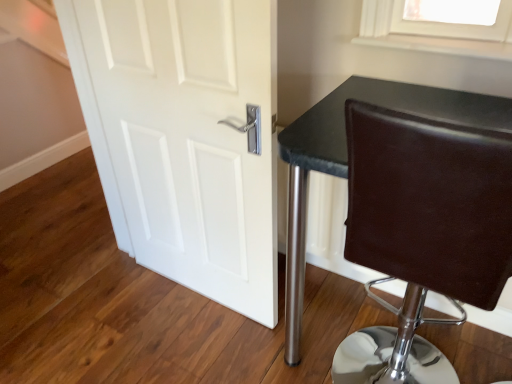
Where is `brown leather chair at right`? brown leather chair at right is located at coordinates (422, 232).

What do you see at coordinates (422, 232) in the screenshot?
I see `brown leather chair at right` at bounding box center [422, 232].

Identify the location of white matte door at center. The height and width of the screenshot is (384, 512). (187, 138).

The width and height of the screenshot is (512, 384). What do you see at coordinates (187, 138) in the screenshot? I see `white matte door at center` at bounding box center [187, 138].

In order to click on brown leather chair at right in this screenshot , I will do `click(422, 232)`.

Between brown leather chair at right and white matte door at center, which one appears on the left side from the viewer's perspective?

Positioned to the left is white matte door at center.

Does brown leather chair at right come in front of white matte door at center?

Answer: Yes, it is in front of white matte door at center.

Between point (423, 344) and point (177, 238), which one is positioned in front?

Point (177, 238)

From the image's perspective, which is below, brown leather chair at right or white matte door at center?

brown leather chair at right, from the image's perspective.

From a real-world perspective, is brown leather chair at right above or below white matte door at center?

brown leather chair at right is situated lower than white matte door at center in the real world.

Considering the relative sizes of brown leather chair at right and white matte door at center in the image provided, is brown leather chair at right thinner than white matte door at center?

In fact, brown leather chair at right might be wider than white matte door at center.

Can you confirm if brown leather chair at right is taller than white matte door at center?

In fact, brown leather chair at right may be shorter than white matte door at center.

Which of these two, brown leather chair at right or white matte door at center, is smaller?

With smaller size is white matte door at center.

Would you say brown leather chair at right is outside white matte door at center?

brown leather chair at right is positioned outside white matte door at center.

Is brown leather chair at right placed right next to white matte door at center?

No, brown leather chair at right is not in contact with white matte door at center.

Could you tell me if brown leather chair at right is turned towards white matte door at center?

No.

Can you tell me how much brown leather chair at right and white matte door at center differ in facing direction?

179 degrees.

The height and width of the screenshot is (384, 512). I want to click on chair below the white matte door at center (from the image's perspective), so coord(422,232).

From the picture: Is white matte door at center to the right of brown leather chair at right from the viewer's perspective?

No.

Is the depth of white matte door at center greater than that of brown leather chair at right?

Yes, white matte door at center is further from the viewer.

Does point (173, 103) come farther from viewer compared to point (361, 261)?

Yes, it is.

From the image's perspective, which one is positioned lower, white matte door at center or brown leather chair at right?

brown leather chair at right is shown below in the image.

From a real-world perspective, which object rests below the other?

From a 3D spatial view, brown leather chair at right is below.

Is white matte door at center wider or thinner than brown leather chair at right?

white matte door at center is thinner than brown leather chair at right.

Considering the sizes of white matte door at center and brown leather chair at right in the image, is white matte door at center taller or shorter than brown leather chair at right?

Clearly, white matte door at center is taller compared to brown leather chair at right.

Based on the photo, can you confirm if white matte door at center is smaller than brown leather chair at right?

Yes.

Is white matte door at center positioned beyond the bounds of brown leather chair at right?

That's correct, white matte door at center is outside of brown leather chair at right.

Is white matte door at center with brown leather chair at right?

white matte door at center is not next to brown leather chair at right, and they're not touching.

Does white matte door at center turn towards brown leather chair at right?

No.

What are the coordinates of `chair on the right of white matte door at center` in the screenshot? It's located at (422, 232).

At what (x,y) coordinates should I click in order to perform the action: click on chair below the white matte door at center (from the image's perspective). Please return your answer as a coordinate pair (x, y). This screenshot has height=384, width=512. Looking at the image, I should click on (422, 232).

Image resolution: width=512 pixels, height=384 pixels. I want to click on chair that appears below the white matte door at center (from a real-world perspective), so click(x=422, y=232).